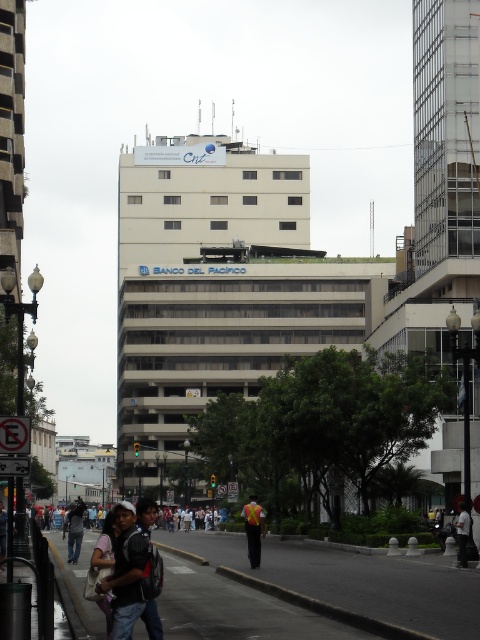
You are standing at the center of the urban street scene described. You see a dark gray fabric jacket at lower right. Where exactly is the dark gray fabric jacket located in relation to your position?

The dark gray fabric jacket at lower right is located at point (x=463, y=534) in the image.

Looking at this image, you are a fashion designer observing people on the street. You notice a dark gray fabric jacket at lower right and a white shirt at center. Which clothing item is shorter in length?

The dark gray fabric jacket at lower right is shorter than the white shirt at center.